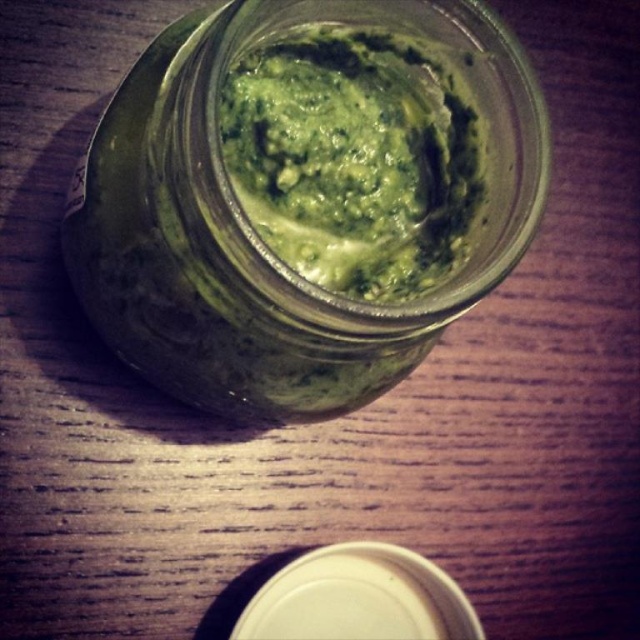
Is green matte glass jar at center closer to camera compared to green paste at center?

Yes.

What do you see at coordinates (257, 236) in the screenshot? Image resolution: width=640 pixels, height=640 pixels. I see `green matte glass jar at center` at bounding box center [257, 236].

Does point (490, 58) lie in front of point (381, 124)?

Yes.

Find the location of a particular element. This screenshot has width=640, height=640. green matte glass jar at center is located at coordinates (257, 236).